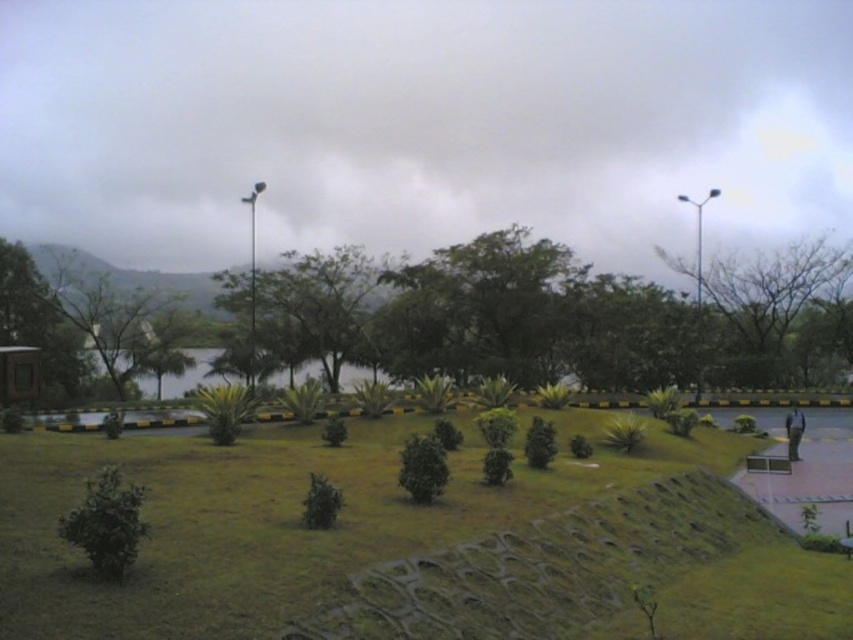
Question: Can you confirm if green leafy tree at left is positioned above green grassy lake at center?

Choices:
 (A) no
 (B) yes

Answer: (B)

Question: Considering the real-world distances, which object is farthest from the green leafy tree at right?

Choices:
 (A) green leafy tree at center
 (B) green grassy lake at center

Answer: (B)

Question: Is green leafy tree at left wider than green leafy tree at right?

Choices:
 (A) yes
 (B) no

Answer: (B)

Question: Is green leafy tree at left thinner than green leafy tree at right?

Choices:
 (A) yes
 (B) no

Answer: (A)

Question: Estimate the real-world distances between objects in this image. Which object is closer to the green leafy tree at center?

Choices:
 (A) green leafy tree at left
 (B) green grassy lake at center

Answer: (B)

Question: Which point appears closest to the camera in this image?

Choices:
 (A) click(x=282, y=256)
 (B) click(x=160, y=291)
 (C) click(x=773, y=253)
 (D) click(x=195, y=369)

Answer: (B)